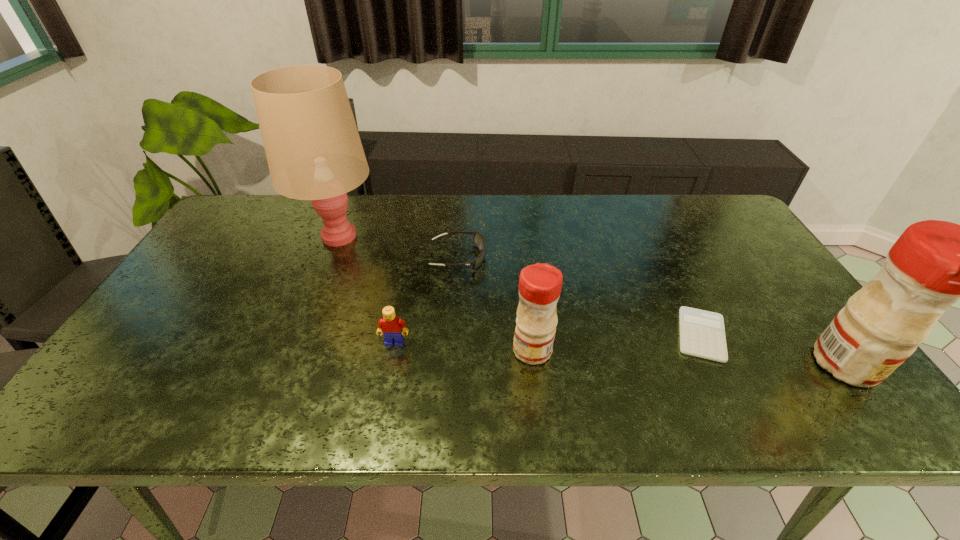
Find the location of a particular element. free space that is in between the right condiment and the fifth tallest object is located at coordinates (652, 311).

Image resolution: width=960 pixels, height=540 pixels. What are the coordinates of `free space between the fifth tallest object and the shorter condiment` in the screenshot? It's located at (495, 303).

The height and width of the screenshot is (540, 960). I want to click on free space between the third shortest object and the fourth object from left to right, so click(x=464, y=346).

You are a GUI agent. You are given a task and a screenshot of the screen. Output one action in this format:
    pyautogui.click(x=<x>, y=<y>)
    Task: Click on the free space between the Lego and the third object from right to left
    Image resolution: width=960 pixels, height=540 pixels.
    Given the screenshot: What is the action you would take?
    pyautogui.click(x=464, y=346)

Locate an element on the screen. Image resolution: width=960 pixels, height=540 pixels. vacant space in between the fourth object from left to right and the fourth tallest object is located at coordinates (464, 346).

At what (x,y) coordinates should I click in order to perform the action: click on object identified as the second closest to the second tallest object. Please return your answer as a coordinate pair (x, y). Looking at the image, I should click on (540, 285).

Where is `object that stands as the fifth closest to the calculator`? object that stands as the fifth closest to the calculator is located at coordinates (314, 152).

Locate an element on the screen. free location that satisfies the following two spatial constraints: 1. on the lenses of the second shortest object; 2. on the right side of the right condiment is located at coordinates (451, 364).

The width and height of the screenshot is (960, 540). I want to click on vacant space that satisfies the following two spatial constraints: 1. on the face of the left condiment; 2. on the left side of the third shortest object, so click(x=394, y=350).

Locate an element on the screen. The image size is (960, 540). free location that satisfies the following two spatial constraints: 1. on the face of the rightmost object; 2. on the right side of the third shortest object is located at coordinates (391, 364).